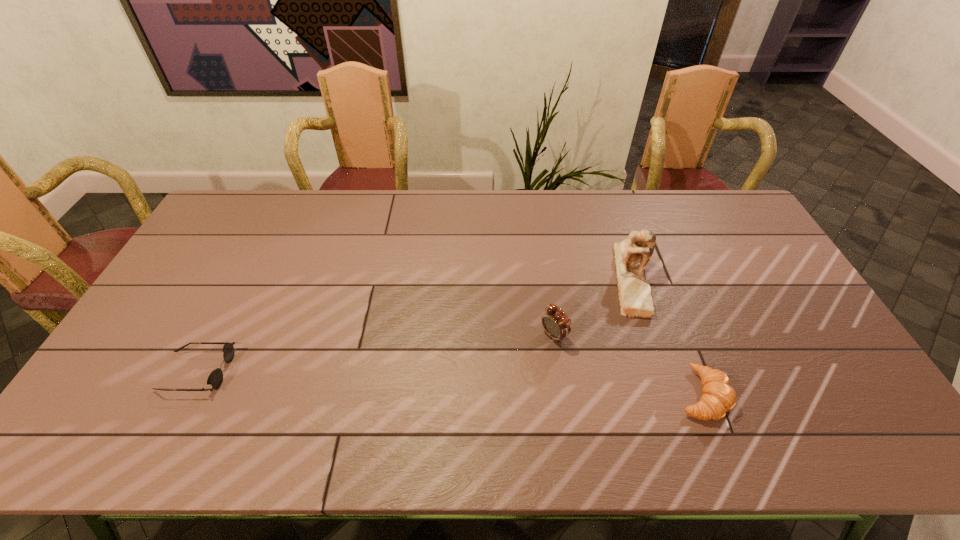
Find the location of `vacant space on the desktop that is between the sunglasses and the third tallest object and is positioned on the face of the second tallest object`. vacant space on the desktop that is between the sunglasses and the third tallest object and is positioned on the face of the second tallest object is located at coordinates (481, 384).

You are a GUI agent. You are given a task and a screenshot of the screen. Output one action in this format:
    pyautogui.click(x=<x>, y=<y>)
    Task: Click on the free space on the desktop that is between the leftmost object and the third tallest object and is positioned on the front-facing side of the figurine
    This screenshot has width=960, height=540.
    Given the screenshot: What is the action you would take?
    pyautogui.click(x=476, y=384)